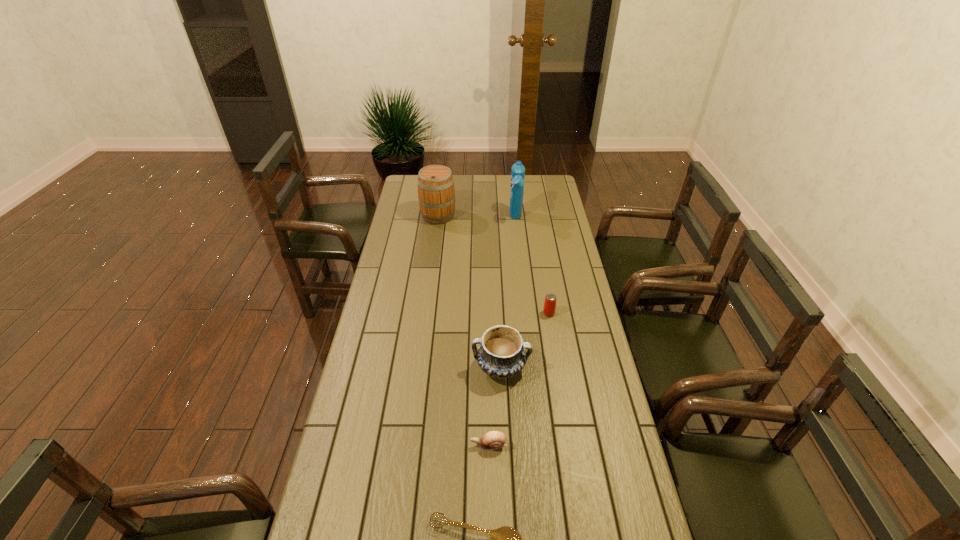
The image size is (960, 540). What are the coordinates of `vacant area that lies between the pottery and the third shortest object` in the screenshot? It's located at (525, 340).

At what (x,y) coordinates should I click in order to perform the action: click on vacant point located between the third farthest object and the escargot. Please return your answer as a coordinate pair (x, y). The image size is (960, 540). Looking at the image, I should click on pyautogui.click(x=518, y=379).

What are the coordinates of `free space that is in between the third tallest object and the shampoo` in the screenshot? It's located at (509, 293).

This screenshot has width=960, height=540. Find the location of `free spot between the fifth farthest object and the beer can`. free spot between the fifth farthest object and the beer can is located at coordinates (518, 379).

Identify the location of object that is the third closest to the fifth farthest object. (549, 308).

Locate an element on the screen. This screenshot has width=960, height=540. object that stands as the third closest to the shampoo is located at coordinates (501, 354).